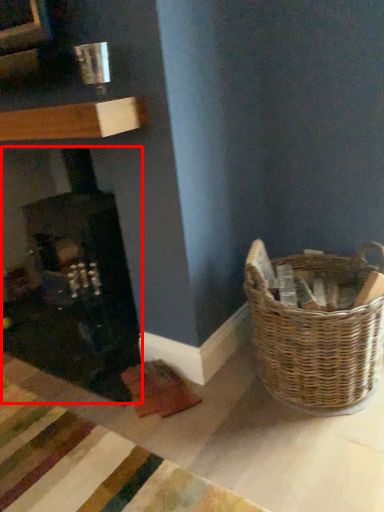
Question: From the image's perspective, considering the relative positions of fireplace (annotated by the red box) and picnic basket in the image provided, where is fireplace (annotated by the red box) located with respect to the staircase?

Choices:
 (A) above
 (B) below

Answer: (A)